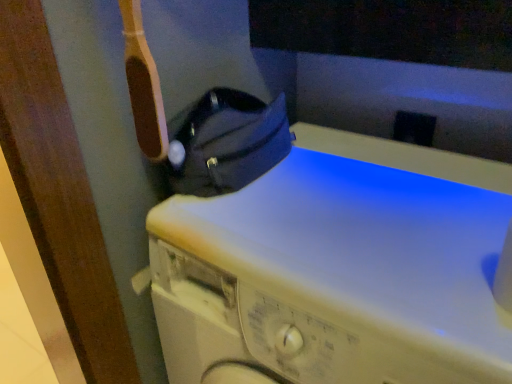
The height and width of the screenshot is (384, 512). What are the coordinates of `vacant space in front of black leather bag at upper left` in the screenshot? It's located at (267, 225).